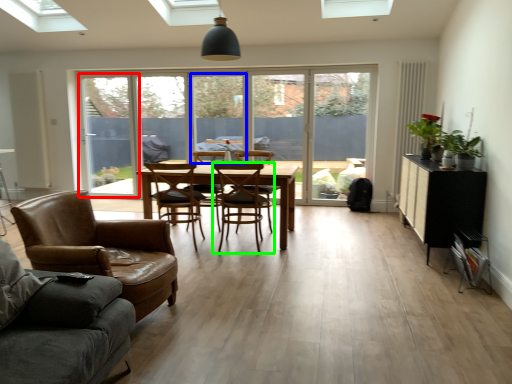
Question: Which object is the closest to the window screen (highlighted by a red box)? Choose among these: window frame (highlighted by a blue box) or chair (highlighted by a green box).

Choices:
 (A) window frame
 (B) chair

Answer: (A)